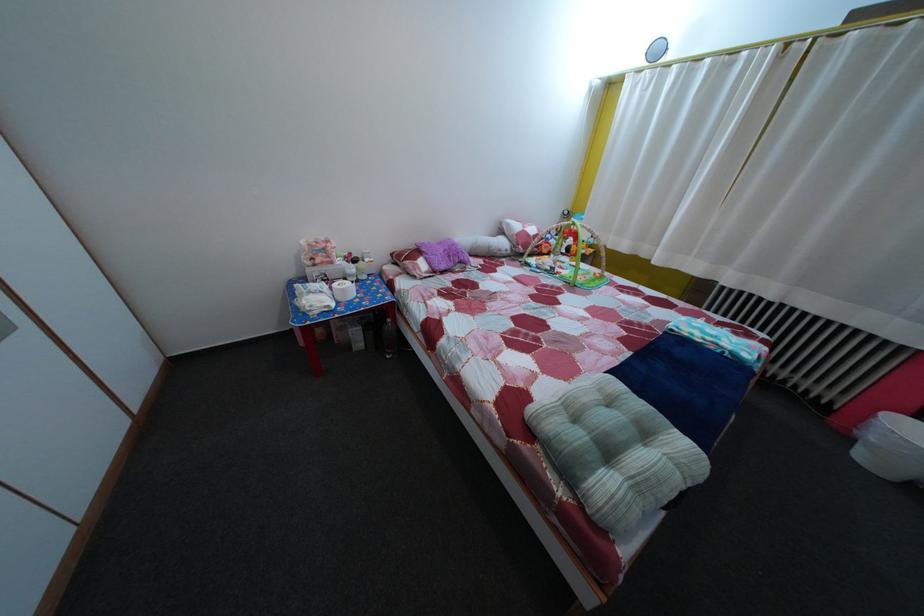
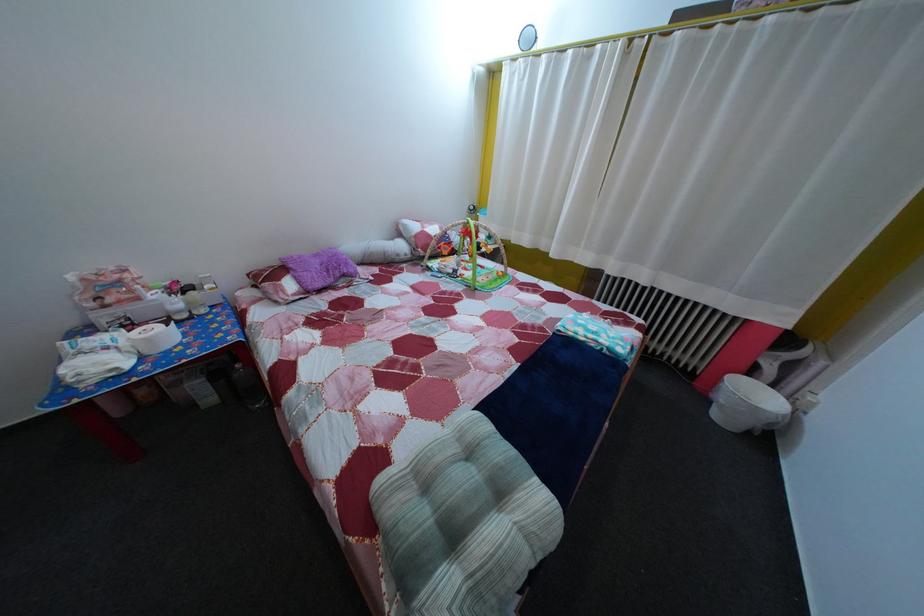
In the second image, find the point that corresponds to the point at 553,259 in the first image.

(455, 261)